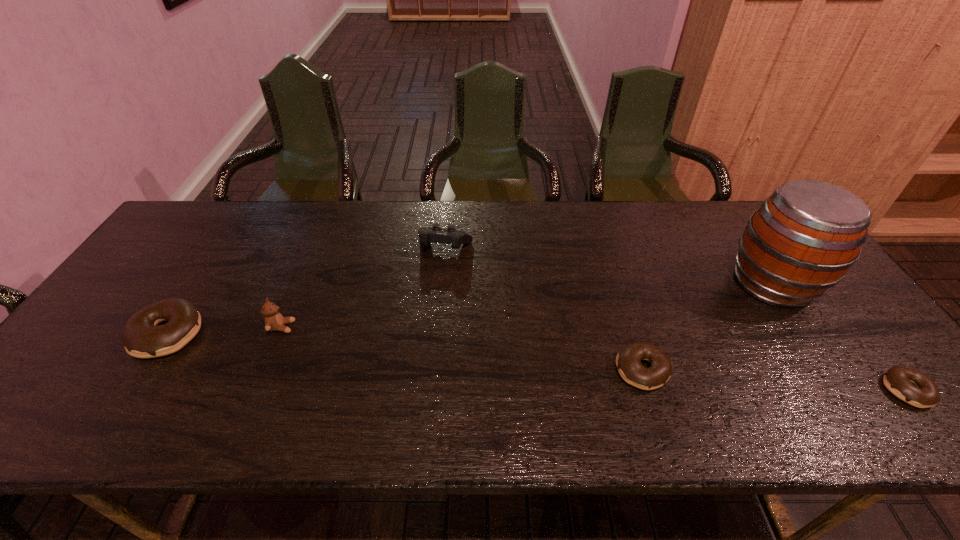
Locate an element on the screen. The image size is (960, 540). doughnut that is the second closest to the control is located at coordinates (142, 338).

This screenshot has height=540, width=960. What are the coordinates of `blank area in the image that satisfies the following two spatial constraints: 1. on the front side of the leftmost doughnut; 2. on the left side of the rightmost doughnut` in the screenshot? It's located at (132, 390).

Find the location of a particular element. free location that satisfies the following two spatial constraints: 1. on the front-facing side of the teddy bear; 2. on the back side of the second doughnut from right to left is located at coordinates (264, 370).

The width and height of the screenshot is (960, 540). I want to click on vacant region that satisfies the following two spatial constraints: 1. on the back side of the cider; 2. on the left side of the second shortest object, so click(x=615, y=283).

Identify the location of vacant area in the image that satisfies the following two spatial constraints: 1. on the back side of the fourth object from left to right; 2. on the front-facing side of the fifth object from right to left. This screenshot has width=960, height=540. (629, 327).

Where is `vacant space that satisfies the following two spatial constraints: 1. on the front-facing side of the second object from left to right; 2. on the back side of the rightmost doughnut`? This screenshot has height=540, width=960. vacant space that satisfies the following two spatial constraints: 1. on the front-facing side of the second object from left to right; 2. on the back side of the rightmost doughnut is located at coordinates [256, 390].